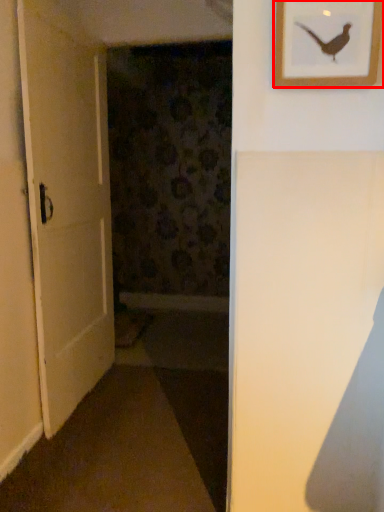
Question: From the image, what is the correct spatial relationship of picture frame (annotated by the red box) in relation to door?

Choices:
 (A) right
 (B) left

Answer: (A)